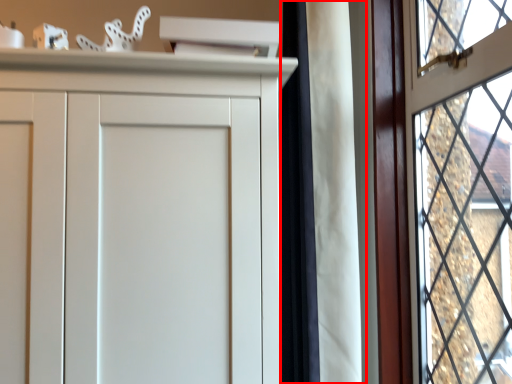
Question: Considering the relative positions of curtain (annotated by the red box) and window in the image provided, where is curtain (annotated by the red box) located with respect to the staircase?

Choices:
 (A) left
 (B) right

Answer: (A)